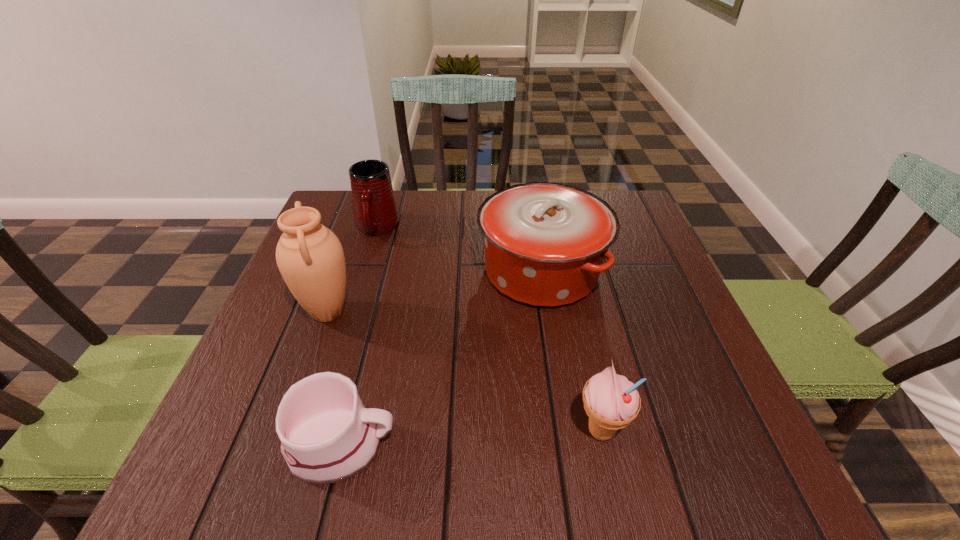
The height and width of the screenshot is (540, 960). In order to click on vacant space positioned 0.290m on the side with the handle of the shorter mug in this screenshot , I will do `click(575, 445)`.

The image size is (960, 540). I want to click on casserole that is at the far edge, so click(545, 243).

Image resolution: width=960 pixels, height=540 pixels. Identify the location of mug that is at the far edge. (375, 210).

You are a GUI agent. You are given a task and a screenshot of the screen. Output one action in this format:
    pyautogui.click(x=<x>, y=<y>)
    Task: Click on the icecream at the near edge
    
    Given the screenshot: What is the action you would take?
    pyautogui.click(x=611, y=401)

What are the coordinates of `mug located at the near edge` in the screenshot? It's located at (327, 436).

Locate an element on the screen. The image size is (960, 540). urn situated at the left edge is located at coordinates (310, 257).

Find the location of a particular element. object that is at the right edge is located at coordinates (545, 243).

Image resolution: width=960 pixels, height=540 pixels. In order to click on object that is positioned at the far left corner in this screenshot , I will do coord(375,210).

Image resolution: width=960 pixels, height=540 pixels. I want to click on object that is at the near left corner, so click(327, 436).

At what (x,y) coordinates should I click in order to perform the action: click on object situated at the far right corner. Please return your answer as a coordinate pair (x, y). The image size is (960, 540). Looking at the image, I should click on (545, 243).